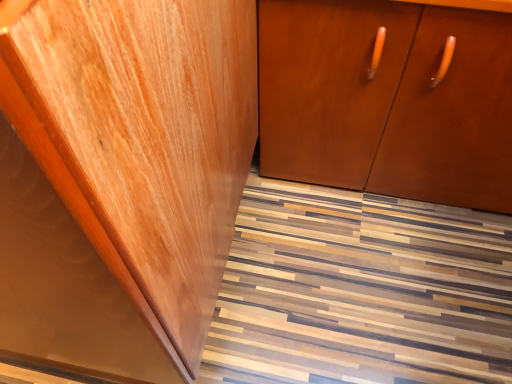
Question: Would you say wooden floor at lower center is part of glossy wood cabinet at left, which appears as the 1th cabinetry when viewed from the left,'s contents?

Choices:
 (A) no
 (B) yes

Answer: (A)

Question: Does glossy wood cabinet at left, which appears as the 1th cabinetry when viewed from the left, have a lesser height compared to wooden floor at lower center?

Choices:
 (A) no
 (B) yes

Answer: (A)

Question: Is the surface of glossy wood cabinet at left, which is the 2th cabinetry from right to left, in direct contact with wooden floor at lower center?

Choices:
 (A) no
 (B) yes

Answer: (A)

Question: Is glossy wood cabinet at left, which appears as the 1th cabinetry when viewed from the left, taller than wooden floor at lower center?

Choices:
 (A) yes
 (B) no

Answer: (A)

Question: Can you confirm if glossy wood cabinet at left, which appears as the 1th cabinetry when viewed from the left, is positioned to the right of wooden floor at lower center?

Choices:
 (A) yes
 (B) no

Answer: (B)

Question: From a real-world perspective, relative to wooden floor at lower center, is matte brown cabinet at center, which ranks as the 2th cabinetry in left-to-right order, vertically above or below?

Choices:
 (A) above
 (B) below

Answer: (A)

Question: Considering the positions of matte brown cabinet at center, which ranks as the 2th cabinetry in left-to-right order, and wooden floor at lower center in the image, is matte brown cabinet at center, which ranks as the 2th cabinetry in left-to-right order, bigger or smaller than wooden floor at lower center?

Choices:
 (A) small
 (B) big

Answer: (B)

Question: Is matte brown cabinet at center, which ranks as the 2th cabinetry in left-to-right order, to the left or to the right of wooden floor at lower center in the image?

Choices:
 (A) left
 (B) right

Answer: (B)

Question: Considering the positions of point (440, 158) and point (416, 334), is point (440, 158) closer or farther from the camera than point (416, 334)?

Choices:
 (A) closer
 (B) farther

Answer: (B)

Question: Do you think wooden floor at lower center is within glossy wood cabinet at left, which is the 2th cabinetry from right to left, or outside of it?

Choices:
 (A) inside
 (B) outside

Answer: (B)

Question: From a real-world perspective, is wooden floor at lower center positioned above or below glossy wood cabinet at left, which appears as the 1th cabinetry when viewed from the left?

Choices:
 (A) above
 (B) below

Answer: (B)

Question: Looking at their shapes, would you say wooden floor at lower center is wider or thinner than glossy wood cabinet at left, which appears as the 1th cabinetry when viewed from the left?

Choices:
 (A) thin
 (B) wide

Answer: (B)

Question: Looking at the image, does wooden floor at lower center seem bigger or smaller compared to glossy wood cabinet at left, which appears as the 1th cabinetry when viewed from the left?

Choices:
 (A) big
 (B) small

Answer: (B)

Question: Is glossy wood cabinet at left, which appears as the 1th cabinetry when viewed from the left, to the left or to the right of matte brown cabinet at center, acting as the first cabinetry starting from the right, in the image?

Choices:
 (A) left
 (B) right

Answer: (A)

Question: Is glossy wood cabinet at left, which is the 2th cabinetry from right to left, taller or shorter than matte brown cabinet at center, which ranks as the 2th cabinetry in left-to-right order?

Choices:
 (A) tall
 (B) short

Answer: (A)